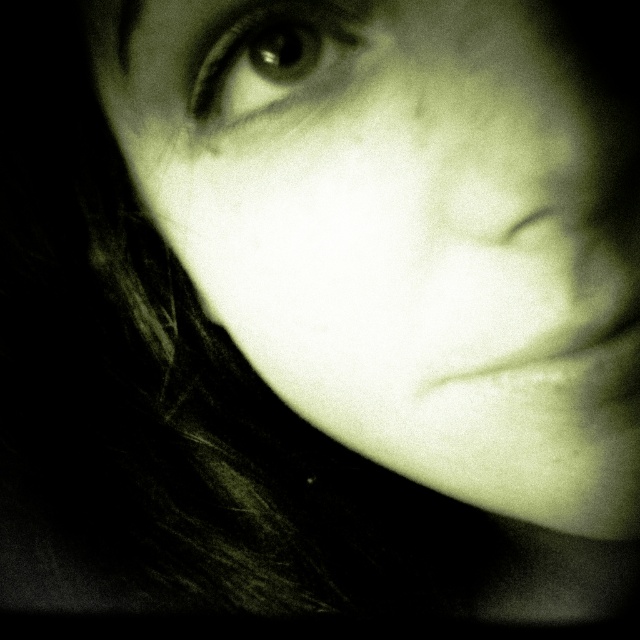
Between matte skin face at center and shiny black eye at upper left, which one appears on the right side from the viewer's perspective?

From the viewer's perspective, matte skin face at center appears more on the right side.

Is matte skin face at center taller than shiny black eye at upper left?

Indeed, matte skin face at center has a greater height compared to shiny black eye at upper left.

Between point (516, 504) and point (257, 17), which one is positioned behind?

The point (516, 504) is more distant.

Find the location of a particular element. This screenshot has width=640, height=640. matte skin face at center is located at coordinates (403, 230).